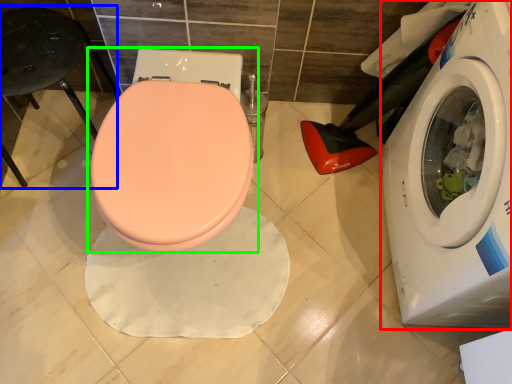
Question: Estimate the real-world distances between objects in this image. Which object is closer to washing machine (highlighted by a red box), bar stool (highlighted by a blue box) or toilet (highlighted by a green box)?

Choices:
 (A) bar stool
 (B) toilet

Answer: (B)